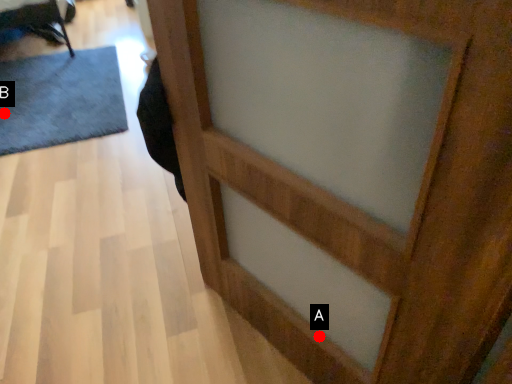
Question: Two points are circled on the image, labeled by A and B beside each circle. Which point is farther from the camera taking this photo?

Choices:
 (A) A is further
 (B) B is further

Answer: (B)